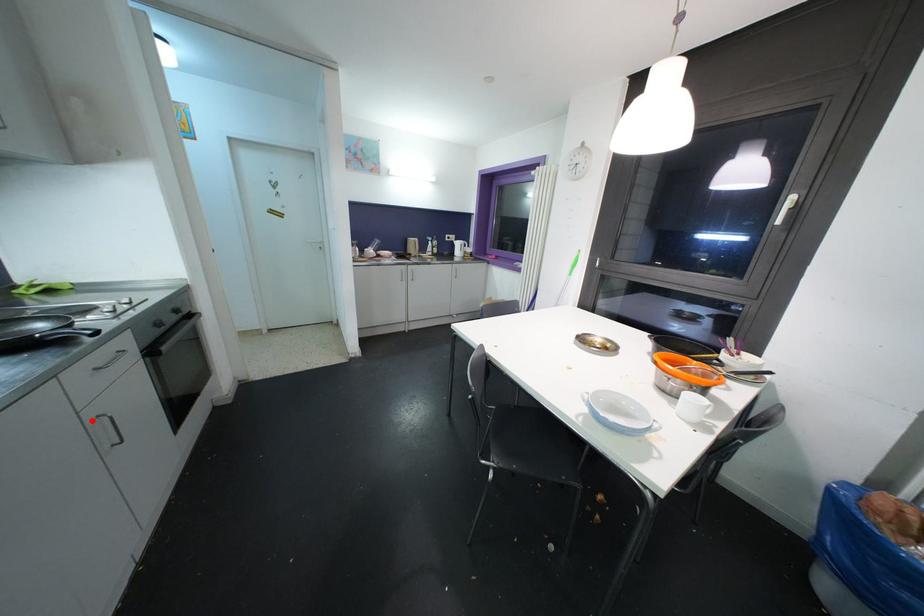
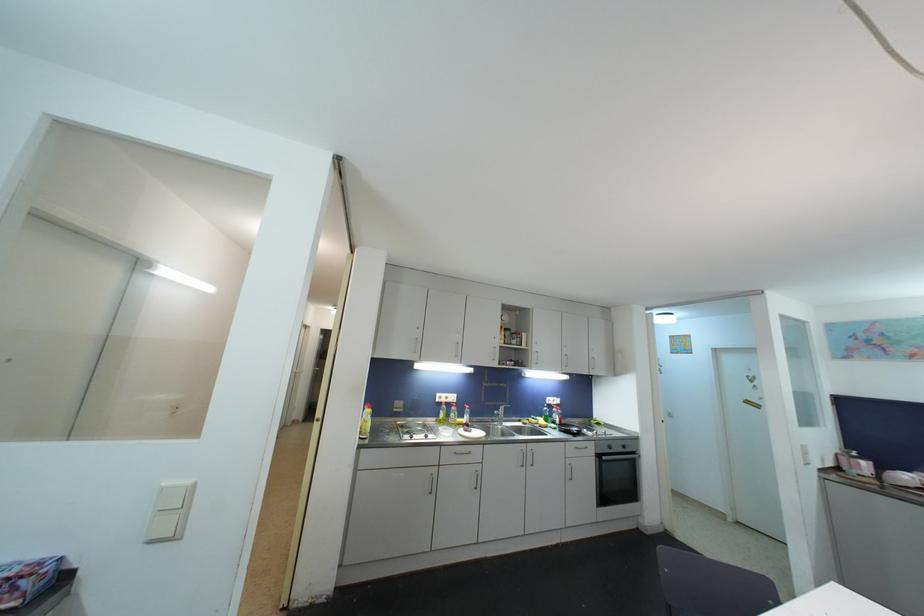
Question: A red point is marked in image1. In image2, is the corresponding 3D point closer to the camera or farther? Reply with the corresponding letter.

Choices:
 (A) The corresponding 3D point is closer.
 (B) The corresponding 3D point is farther.

Answer: (B)